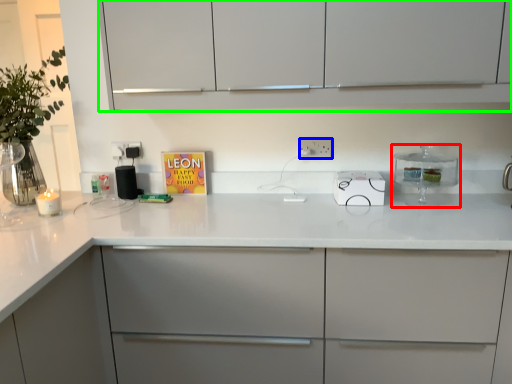
Question: Considering the real-world distances, which object is farthest from kitchen appliance (highlighted by a red box)? electric outlet (highlighted by a blue box) or cabinetry (highlighted by a green box)?

Choices:
 (A) electric outlet
 (B) cabinetry

Answer: (B)